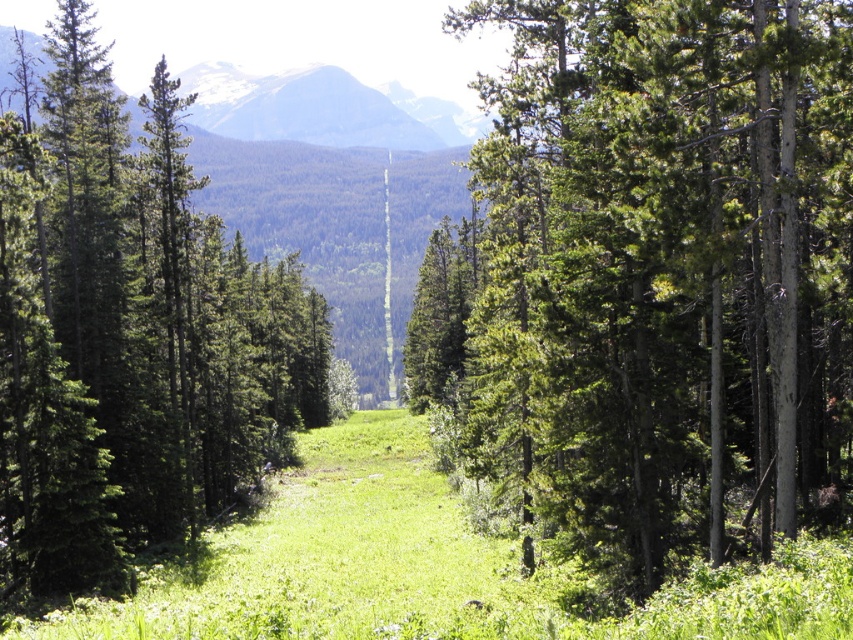
You are standing in a forest and want to take a photo of the green textured tree at center. If your camera has a maximum focus range of 50 feet, will you be able to capture the tree clearly?

The green textured tree at center is 48.47 feet away from the camera, which is within the maximum focus range of 50 feet. Therefore, you can capture the tree clearly.

You are standing in the forest and see the green matte tree at left and the green grassy at center. Which object is positioned more to the left side of the scene?

The green matte tree at left is positioned to the left of the green grassy at center, so it is more to the left side of the scene.

You are standing at the camera position in the forest scene. There is a green matte tree at left. Can you safely walk towards it without needing to climb over any obstacles?

The green matte tree at left is 26.18 meters away from the camera position. Since there are no obstacles mentioned between you and the tree, you can safely walk towards it.